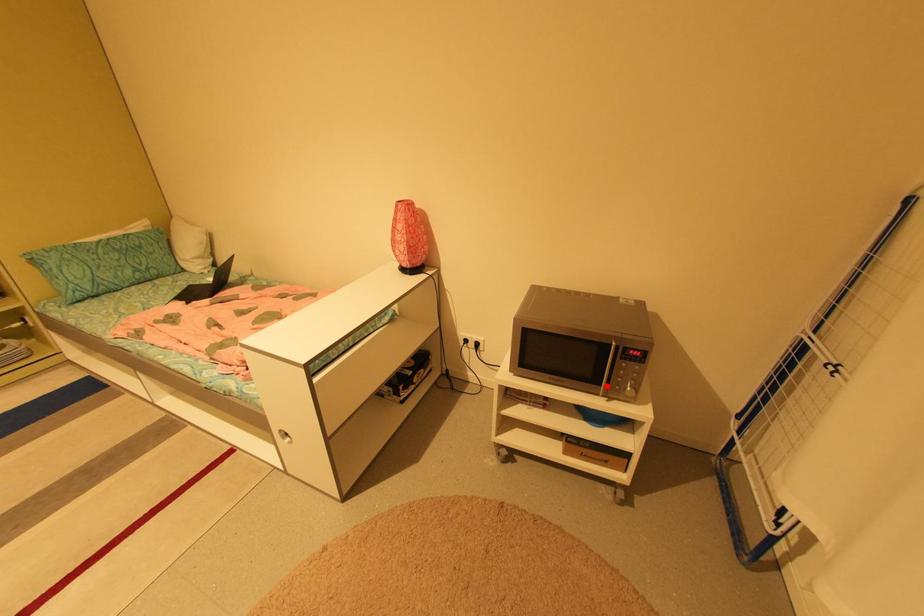
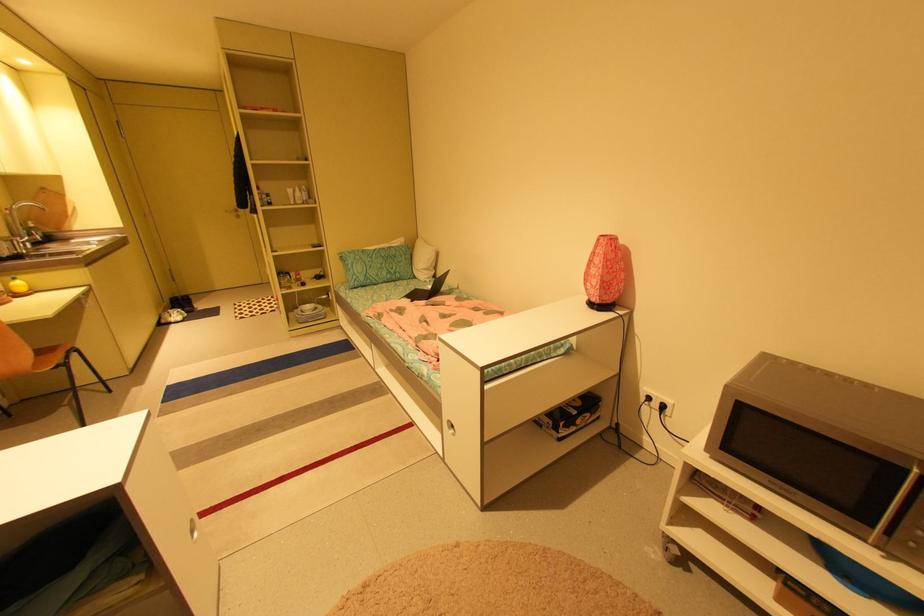
Question: A red point is marked in image1. In image2, is the corresponding 3D point closer to the camera or farther? Reply with the corresponding letter.

Choices:
 (A) The corresponding 3D point is closer.
 (B) The corresponding 3D point is farther.

Answer: (A)